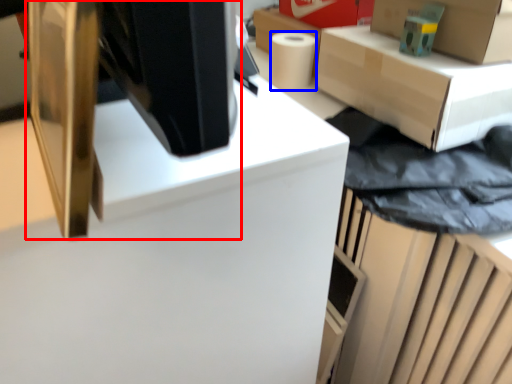
Question: Which object appears farthest to the camera in this image, desktop computer (highlighted by a red box) or paper towel (highlighted by a blue box)?

Choices:
 (A) desktop computer
 (B) paper towel

Answer: (B)